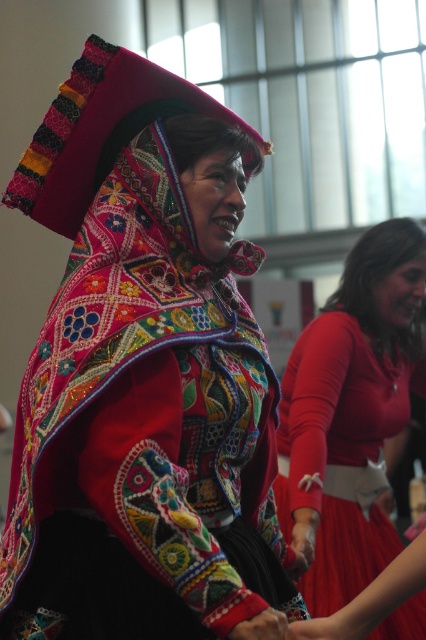
Question: Observing the image, what is the correct spatial positioning of embroidered fabric shawl at center in reference to matte red dress at center?

Choices:
 (A) below
 (B) above

Answer: (B)

Question: Which object is closer to the camera taking this photo?

Choices:
 (A) embroidered fabric shawl at center
 (B) matte red dress at center

Answer: (A)

Question: Can you confirm if embroidered fabric shawl at center is smaller than matte red dress at center?

Choices:
 (A) yes
 (B) no

Answer: (A)

Question: Which point is closer to the camera?

Choices:
 (A) (409, 280)
 (B) (227, 211)

Answer: (B)

Question: Which object is closer to the camera taking this photo?

Choices:
 (A) embroidered fabric shawl at center
 (B) matte red dress at center

Answer: (A)

Question: Does embroidered fabric shawl at center appear over matte red dress at center?

Choices:
 (A) no
 (B) yes

Answer: (B)